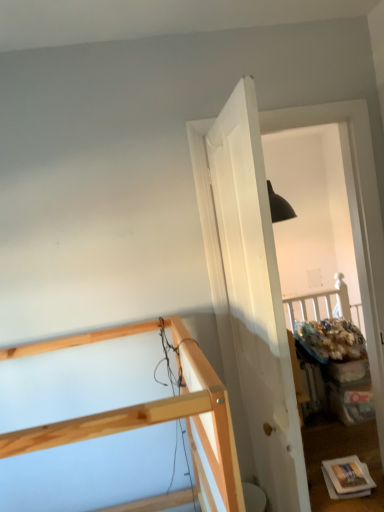
This screenshot has width=384, height=512. Describe the element at coordinates (154, 415) in the screenshot. I see `natural wood bunk bed at upper left` at that location.

You are a GUI agent. You are given a task and a screenshot of the screen. Output one action in this format:
    pyautogui.click(x=<x>, y=<y>)
    Task: Click on the natural wood bunk bed at upper left
    This screenshot has height=512, width=384.
    Given the screenshot: What is the action you would take?
    pyautogui.click(x=154, y=415)

What are the coordinates of `white matte door at center` in the screenshot? It's located at (256, 298).

The width and height of the screenshot is (384, 512). What do you see at coordinates (256, 298) in the screenshot?
I see `white matte door at center` at bounding box center [256, 298].

This screenshot has width=384, height=512. Find the location of `natural wood bunk bed at upper left`. natural wood bunk bed at upper left is located at coordinates (154, 415).

Between natural wood bunk bed at upper left and white matte door at center, which one appears on the right side from the viewer's perspective?

Positioned to the right is white matte door at center.

Is natural wood bunk bed at upper left behind white matte door at center?

No, the depth of natural wood bunk bed at upper left is less than that of white matte door at center.

Which point is more forward, [212,426] or [251,187]?

Point [212,426]

From the image's perspective, who appears lower, natural wood bunk bed at upper left or white matte door at center?

natural wood bunk bed at upper left is shown below in the image.

From a real-world perspective, is natural wood bunk bed at upper left beneath white matte door at center?

Correct, in the physical world, natural wood bunk bed at upper left is lower than white matte door at center.

Considering the relative sizes of natural wood bunk bed at upper left and white matte door at center in the image provided, is natural wood bunk bed at upper left thinner than white matte door at center?

In fact, natural wood bunk bed at upper left might be wider than white matte door at center.

Who is shorter, natural wood bunk bed at upper left or white matte door at center?

natural wood bunk bed at upper left.

Considering the relative sizes of natural wood bunk bed at upper left and white matte door at center in the image provided, is natural wood bunk bed at upper left smaller than white matte door at center?

No.

Is natural wood bunk bed at upper left not inside white matte door at center?

natural wood bunk bed at upper left is positioned outside white matte door at center.

Is natural wood bunk bed at upper left directly adjacent to white matte door at center?

natural wood bunk bed at upper left and white matte door at center are clearly separated.

Is natural wood bunk bed at upper left oriented away from white matte door at center?

No, natural wood bunk bed at upper left's orientation is not away from white matte door at center.

This screenshot has width=384, height=512. Find the location of `door on the right of natural wood bunk bed at upper left`. door on the right of natural wood bunk bed at upper left is located at coordinates (256, 298).

Based on the photo, which is more to the left, white matte door at center or natural wood bunk bed at upper left?

natural wood bunk bed at upper left.

Which is behind, white matte door at center or natural wood bunk bed at upper left?

Positioned behind is white matte door at center.

Does point (310, 509) come behind point (151, 419)?

Yes, it is behind point (151, 419).

From the image's perspective, who appears lower, white matte door at center or natural wood bunk bed at upper left?

natural wood bunk bed at upper left, from the image's perspective.

From a real-world perspective, which object rests below the other?

natural wood bunk bed at upper left.

Is white matte door at center thinner than natural wood bunk bed at upper left?

Correct, the width of white matte door at center is less than that of natural wood bunk bed at upper left.

In terms of height, does white matte door at center look taller or shorter compared to natural wood bunk bed at upper left?

white matte door at center is taller than natural wood bunk bed at upper left.

Considering the sizes of white matte door at center and natural wood bunk bed at upper left in the image, is white matte door at center bigger or smaller than natural wood bunk bed at upper left?

In the image, white matte door at center appears to be smaller than natural wood bunk bed at upper left.

Could natural wood bunk bed at upper left be considered to be inside white matte door at center?

No.

Is white matte door at center not close to natural wood bunk bed at upper left?

No, white matte door at center is not far away from natural wood bunk bed at upper left.

Is white matte door at center aimed at natural wood bunk bed at upper left?

Yes, white matte door at center is turned towards natural wood bunk bed at upper left.

Can you tell me how much white matte door at center and natural wood bunk bed at upper left differ in facing direction?

93.2 degrees separate the facing orientations of white matte door at center and natural wood bunk bed at upper left.

You are a GUI agent. You are given a task and a screenshot of the screen. Output one action in this format:
    pyautogui.click(x=<x>, y=<y>)
    Task: Click on the door located above the natural wood bunk bed at upper left (from a real-world perspective)
    The height and width of the screenshot is (512, 384).
    Given the screenshot: What is the action you would take?
    pyautogui.click(x=256, y=298)

The width and height of the screenshot is (384, 512). Find the location of `door on the right side of natural wood bunk bed at upper left`. door on the right side of natural wood bunk bed at upper left is located at coordinates (256, 298).

Image resolution: width=384 pixels, height=512 pixels. What are the coordinates of `door located behind the natural wood bunk bed at upper left` in the screenshot? It's located at (256, 298).